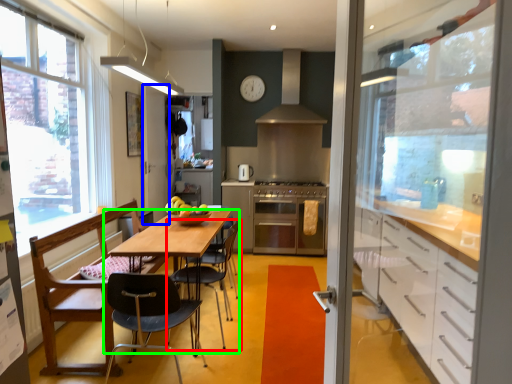
Question: Considering the real-world distances, which object is farthest from chair (highlighted by a red box)? screen door (highlighted by a blue box) or table (highlighted by a green box)?

Choices:
 (A) screen door
 (B) table

Answer: (A)